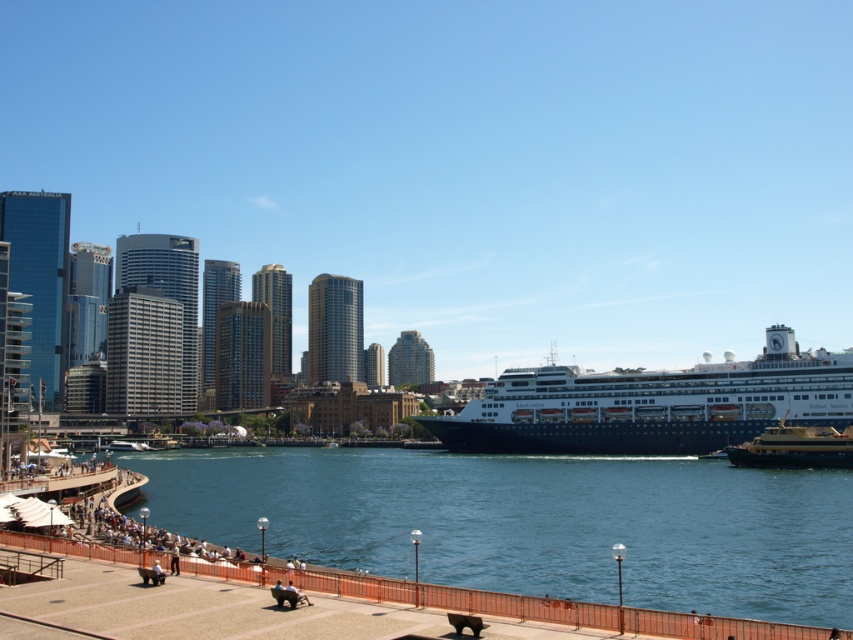
You are a photographer standing on the walkway and want to capture the entire gold polished metal ferry at center and the blue water at lower center in one shot. Considering the width of the ferry and the water, which one requires you to adjust your camera angle more to fit into the frame?

The blue water at lower center might be wider than gold polished metal ferry at center, so you might need to adjust your camera angle more to include the entire blue water at lower center in the shot.

You are a photographer standing on the walkway and want to take a photo of the gold polished metal ferry at center and the blue glossy cruise ship at center. Which one should you focus on first to ensure both are in sharp focus?

The gold polished metal ferry at center is behind the blue glossy cruise ship at center, so you should focus on the blue glossy cruise ship at center first to ensure both are in sharp focus.